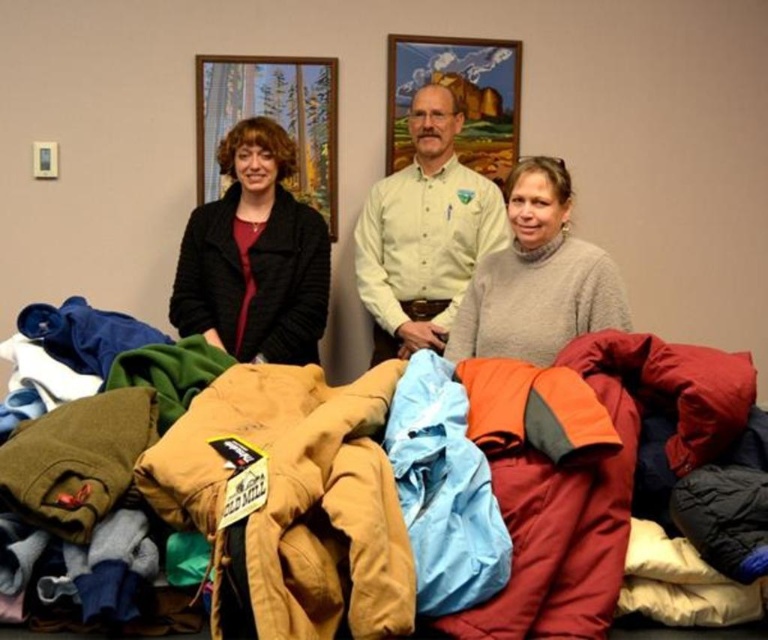
Question: Which object is farther from the camera taking this photo?

Choices:
 (A) wooden picture frame at upper center
 (B) matte black jacket at center
 (C) light gray wool sweater at center
 (D) textured fleece jackets at center

Answer: (A)

Question: Does textured fleece jackets at center appear under wooden frame at upper center?

Choices:
 (A) yes
 (B) no

Answer: (A)

Question: Which point appears closest to the camera in this image?

Choices:
 (A) (444, 60)
 (B) (379, 621)
 (C) (402, 284)

Answer: (B)

Question: Can you confirm if white button-down shirt at center is smaller than wooden picture frame at upper center?

Choices:
 (A) no
 (B) yes

Answer: (A)

Question: Which point appears closest to the camera in this image?

Choices:
 (A) (250, 486)
 (B) (257, 257)

Answer: (A)

Question: Does white button-down shirt at center come behind wooden frame at upper center?

Choices:
 (A) no
 (B) yes

Answer: (A)